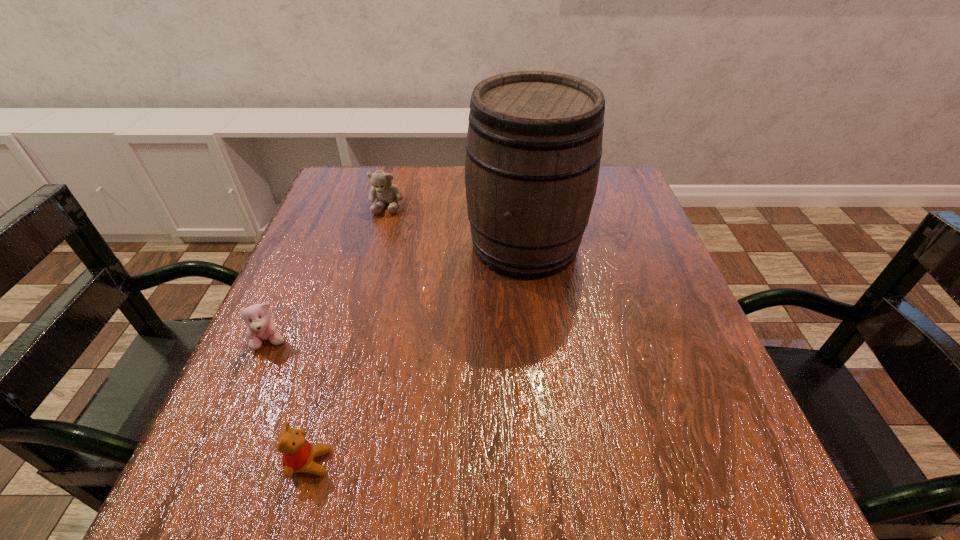
Find the location of a particular element. The width and height of the screenshot is (960, 540). wine bucket located at the far edge is located at coordinates (534, 144).

Locate an element on the screen. teddy bear that is at the far edge is located at coordinates (382, 188).

I want to click on object that is at the near edge, so click(x=298, y=454).

The width and height of the screenshot is (960, 540). I want to click on object that is at the far left corner, so click(382, 188).

The width and height of the screenshot is (960, 540). I want to click on object that is at the near left corner, so click(298, 454).

Find the location of a particular element. Image resolution: width=960 pixels, height=540 pixels. free space at the far edge of the desktop is located at coordinates (405, 172).

The image size is (960, 540). In the image, there is a desktop. What are the coordinates of `blank space at the near edge` in the screenshot? It's located at (522, 469).

Locate an element on the screen. This screenshot has height=540, width=960. vacant region at the left edge is located at coordinates (348, 244).

You are a GUI agent. You are given a task and a screenshot of the screen. Output one action in this format:
    pyautogui.click(x=<x>, y=<y>)
    Task: Click on the vacant space at the far left corner of the desktop
    
    Given the screenshot: What is the action you would take?
    pyautogui.click(x=357, y=201)

At what (x,y) coordinates should I click in order to perform the action: click on free space at the near left corner of the desktop. Please return your answer as a coordinate pair (x, y). Image resolution: width=960 pixels, height=540 pixels. Looking at the image, I should click on (203, 487).